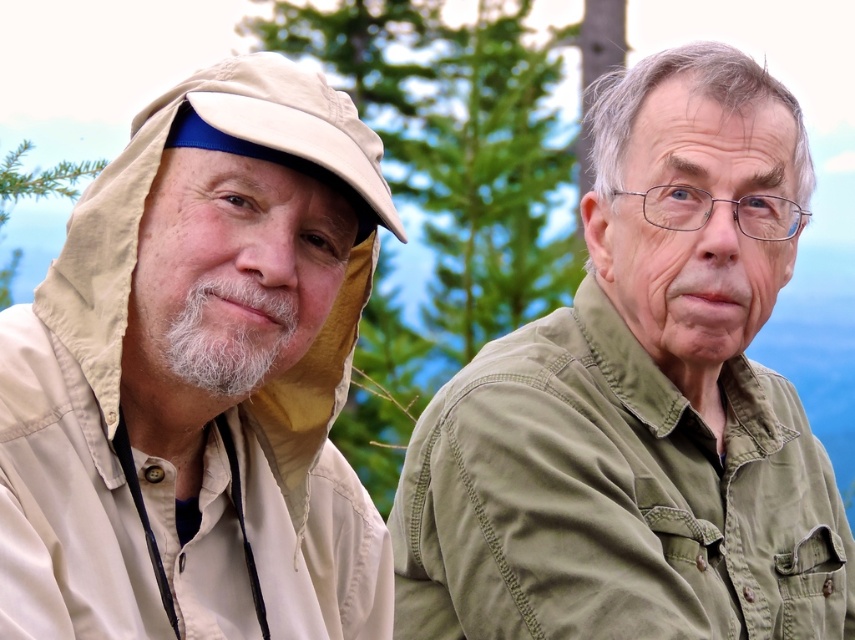
Based on the scene description, which object is taller between the beige fabric hat at upper left and the green cotton shirt at right?

The green cotton shirt at right is taller than the beige fabric hat at upper left.

You are a photographer trying to capture a portrait of the two people in the image. You want to ensure that both the beige fabric hat at upper left and the green cotton shirt at right are clearly visible in the frame. Based on their positions, which object should you focus on first to ensure both are in focus?

The beige fabric hat at upper left is located above the green cotton shirt at right, so focusing on the green cotton shirt at right first will ensure both are in focus since it is closer to the camera.

You are a photographer standing 2 meters away from the beige fabric hat at upper left. Can you reach it without moving your feet?

The beige fabric hat at upper left is 1.63 meters away from the camera, so if you are standing 2 meters away from it, you cannot reach it without moving your feet since the distance is greater than your arm length.